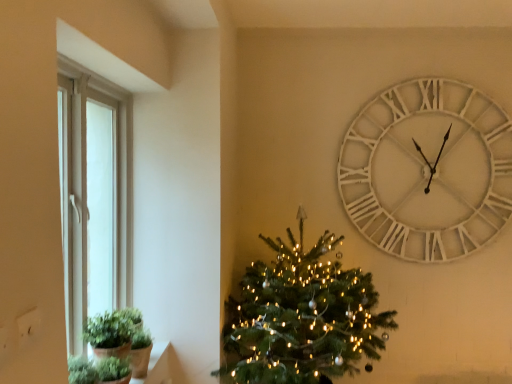
The height and width of the screenshot is (384, 512). Describe the element at coordinates (121, 338) in the screenshot. I see `green matte plant at lower left` at that location.

The image size is (512, 384). Describe the element at coordinates (113, 368) in the screenshot. I see `green matte plant at lower left` at that location.

Looking at this image, measure the distance between white wooden clock at upper right and camera.

white wooden clock at upper right is 2.78 meters away from camera.

The image size is (512, 384). Describe the element at coordinates (428, 170) in the screenshot. I see `white wooden clock at upper right` at that location.

I want to click on green matte christmas tree at center, so click(301, 317).

In order to face green matte christmas tree at center, should I rotate leftwards or rightwards?

Turn right by 7.739 degrees to look at green matte christmas tree at center.

In order to click on green matte plant at lower left in this screenshot , I will do `click(121, 338)`.

Does green matte christmas tree at center have a lesser width compared to green matte plant at lower left?

In fact, green matte christmas tree at center might be wider than green matte plant at lower left.

Is green matte christmas tree at center inside or outside of green matte plant at lower left?

green matte christmas tree at center exists outside the volume of green matte plant at lower left.

In the scene shown: From a real-world perspective, between green matte christmas tree at center and green matte plant at lower left, who is vertically higher?

From a 3D spatial view, green matte plant at lower left is above.

Which point is more distant from viewer, (x=289, y=278) or (x=144, y=375)?

The point (x=289, y=278) is more distant.

Does green matte plant at lower left lie behind white wooden clock at upper right?

No.

Is green matte plant at lower left thinner than white wooden clock at upper right?

No.

Is green matte plant at lower left positioned with its back to white wooden clock at upper right?

No.

From the image's perspective, between green matte plant at lower left and white wooden clock at upper right, which one is located above?

white wooden clock at upper right is shown above in the image.

Is there a large distance between green matte plant at lower left and white wooden clock at upper right?

Absolutely, green matte plant at lower left is distant from white wooden clock at upper right.

What's the angular difference between green matte plant at lower left and white wooden clock at upper right's facing directions?

The facing directions of green matte plant at lower left and white wooden clock at upper right are 93.1 degrees apart.

How distant is green matte plant at lower left from white wooden clock at upper right?

The distance of green matte plant at lower left from white wooden clock at upper right is 2.16 meters.

Find the location of a particular element. The image size is (512, 384). plant in front of the white wooden clock at upper right is located at coordinates (113, 368).

How distant is white wooden clock at upper right from green matte plant at lower left?

white wooden clock at upper right and green matte plant at lower left are 2.16 meters apart from each other.

Is white wooden clock at upper right not within green matte plant at lower left?

That's correct, white wooden clock at upper right is outside of green matte plant at lower left.

From the image's perspective, is white wooden clock at upper right over green matte plant at lower left?

Yes, from the image's perspective, white wooden clock at upper right is over green matte plant at lower left.

Locate an element on the screen. plant that is above the green matte christmas tree at center (from a real-world perspective) is located at coordinates (113, 368).

Does green matte plant at lower left turn towards green matte christmas tree at center?

No, green matte plant at lower left is not turned towards green matte christmas tree at center.

Looking at this image, from the image's perspective, which one is positioned higher, green matte plant at lower left or green matte christmas tree at center?

green matte christmas tree at center.

Can you confirm if green matte plant at lower left is taller than green matte plant at lower left?

In fact, green matte plant at lower left may be shorter than green matte plant at lower left.

From the image's perspective, would you say green matte plant at lower left is shown under green matte plant at lower left?

Yes, from the image's perspective, green matte plant at lower left is beneath green matte plant at lower left.

From the picture: Can green matte plant at lower left be found inside green matte plant at lower left?

No, green matte plant at lower left is located outside of green matte plant at lower left.

Which of these two, white wooden clock at upper right or green matte plant at lower left, is bigger?

With larger size is white wooden clock at upper right.

Is white wooden clock at upper right not inside green matte plant at lower left?

Yes, white wooden clock at upper right is located beyond the bounds of green matte plant at lower left.

Locate an element on the screen. The width and height of the screenshot is (512, 384). houseplant that appears below the white wooden clock at upper right (from a real-world perspective) is located at coordinates (121, 338).

Does white wooden clock at upper right have a greater height compared to green matte plant at lower left?

Correct, white wooden clock at upper right is much taller as green matte plant at lower left.

Identify the location of christmas tree beneath the green matte plant at lower left (from a real-world perspective). (301, 317).

The image size is (512, 384). Find the location of `wall clock on the right of green matte plant at lower left`. wall clock on the right of green matte plant at lower left is located at coordinates (428, 170).

Which object lies nearer to the anchor point green matte plant at lower left, green matte christmas tree at center or white wooden clock at upper right?

green matte christmas tree at center is positioned closer to the anchor green matte plant at lower left.

Based on their spatial positions, is green matte plant at lower left or green matte plant at lower left further from green matte christmas tree at center?

green matte plant at lower left.

Looking at the image, which one is located further to green matte plant at lower left, white wooden clock at upper right or green matte christmas tree at center?

white wooden clock at upper right is positioned further to the anchor green matte plant at lower left.

Estimate the real-world distances between objects in this image. Which object is further from white wooden clock at upper right, green matte christmas tree at center or green matte plant at lower left?

green matte plant at lower left lies further to white wooden clock at upper right than the other object.

From the image, which object appears to be nearer to green matte plant at lower left, green matte christmas tree at center or white wooden clock at upper right?

green matte christmas tree at center lies closer to green matte plant at lower left than the other object.

Based on their spatial positions, is white wooden clock at upper right or green matte christmas tree at center further from green matte plant at lower left?

white wooden clock at upper right is further to green matte plant at lower left.

Looking at the image, which one is located closer to green matte christmas tree at center, green matte plant at lower left or white wooden clock at upper right?

green matte plant at lower left lies closer to green matte christmas tree at center than the other object.

Looking at the image, which one is located closer to green matte plant at lower left, green matte plant at lower left or white wooden clock at upper right?

green matte plant at lower left lies closer to green matte plant at lower left than the other object.

Where is `plant between green matte plant at lower left and white wooden clock at upper right`? plant between green matte plant at lower left and white wooden clock at upper right is located at coordinates (113, 368).

This screenshot has width=512, height=384. Identify the location of plant situated between green matte plant at lower left and green matte christmas tree at center from left to right. (113, 368).

You are a GUI agent. You are given a task and a screenshot of the screen. Output one action in this format:
    pyautogui.click(x=<x>, y=<y>)
    Task: Click on the christmas tree between green matte plant at lower left and white wooden clock at upper right
    
    Given the screenshot: What is the action you would take?
    pyautogui.click(x=301, y=317)

Find the location of a particular element. This screenshot has height=384, width=512. christmas tree located between green matte plant at lower left and white wooden clock at upper right in the left-right direction is located at coordinates (301, 317).